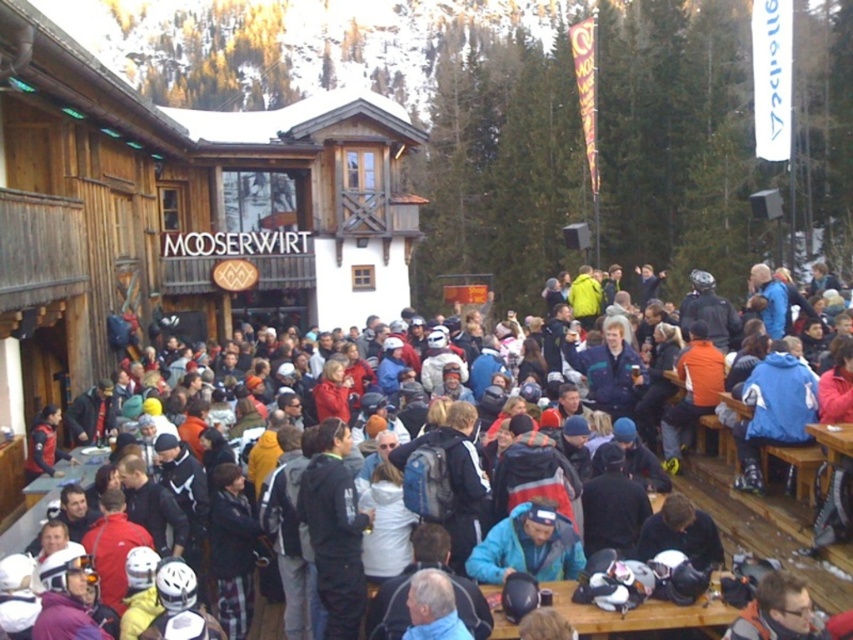
Question: Is wooden cabin at center above multicolored jackets at center?

Choices:
 (A) no
 (B) yes

Answer: (B)

Question: Is wooden cabin at center thinner than multicolored jackets at center?

Choices:
 (A) yes
 (B) no

Answer: (A)

Question: Is wooden cabin at center behind multicolored jackets at center?

Choices:
 (A) yes
 (B) no

Answer: (A)

Question: Which point appears closest to the camera in this image?

Choices:
 (A) (735, 536)
 (B) (68, 161)

Answer: (A)